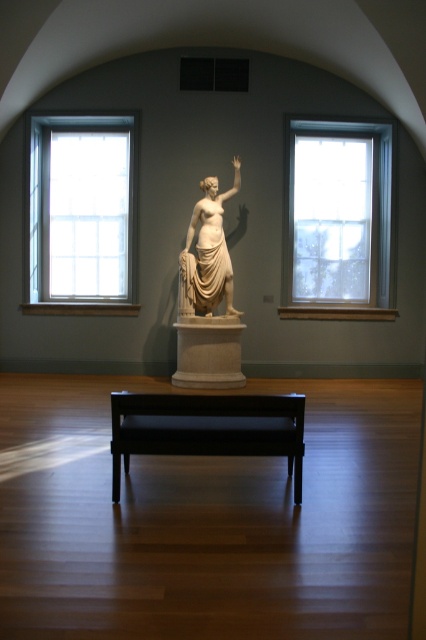
Which is more to the left, clear glass window at right or white marble statue at center?

white marble statue at center is more to the left.

The width and height of the screenshot is (426, 640). I want to click on clear glass window at right, so click(x=339, y=220).

Who is higher up, clear glass window at right or white marble pedestal at center?

Positioned higher is clear glass window at right.

Can you confirm if clear glass window at right is taller than white marble pedestal at center?

Yes, clear glass window at right is taller than white marble pedestal at center.

Who is more distant from viewer, (379, 147) or (236, 355)?

The point (379, 147) is more distant.

Where is `clear glass window at right`? clear glass window at right is located at coordinates (339, 220).

Does clear glass window at left have a smaller size compared to clear glass window at right?

Actually, clear glass window at left might be larger than clear glass window at right.

Where is `clear glass window at left`? clear glass window at left is located at coordinates (81, 214).

Where is `clear glass window at left`? This screenshot has width=426, height=640. clear glass window at left is located at coordinates 81,214.